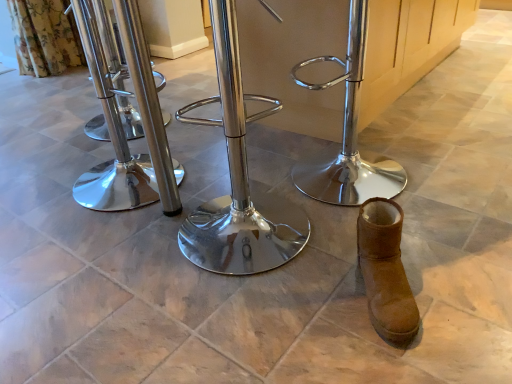
Locate an element on the screen. vacant area that lies between polished metal swivel chair at center, which is the second swivel chair from right to left, and brown suede boot at lower right is located at coordinates (306, 280).